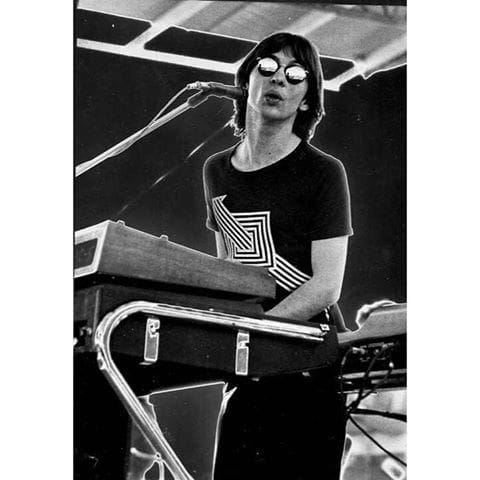
At what (x,y) coordinates should I click in order to perform the action: click on mic. Please return your answer as a coordinate pair (x, y). Looking at the image, I should click on (234, 90).